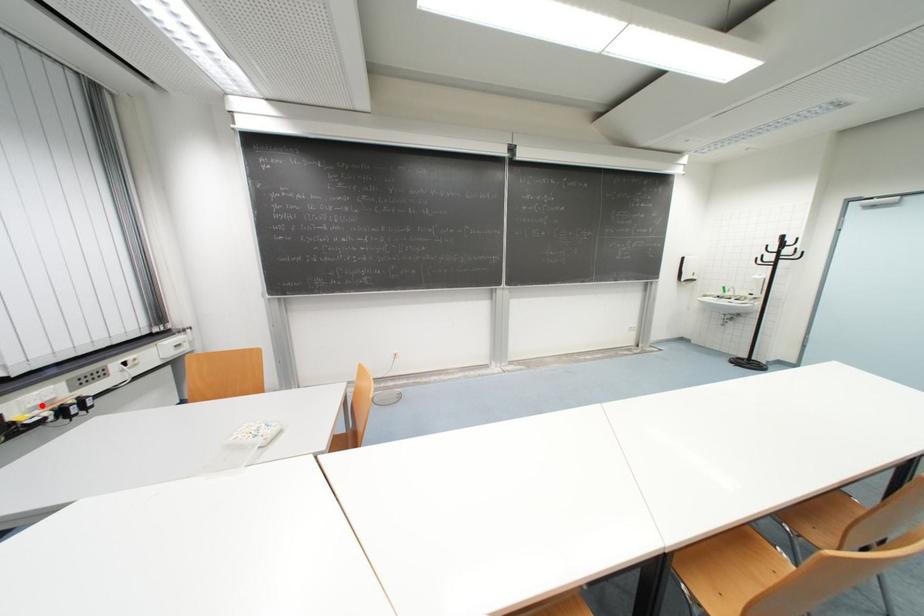
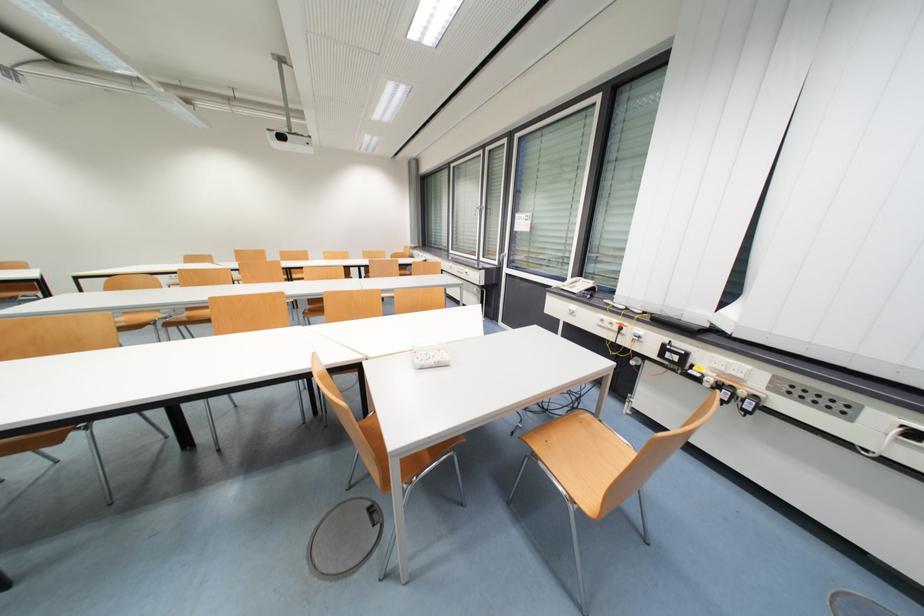
Question: I am providing you with two images of the same scene from different viewpoints. Image1 has a red point marked. In image2, the corresponding 3D location appears at what relative position? Reply with the corresponding letter.

Choices:
 (A) Closer
 (B) Farther

Answer: (A)